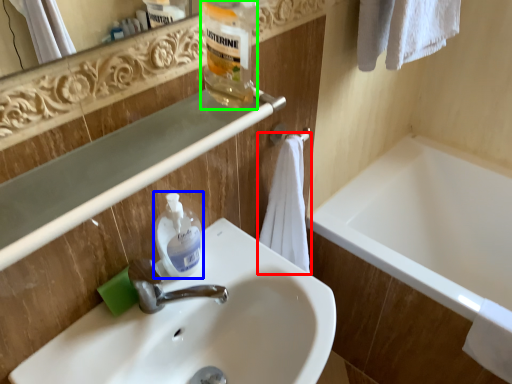
Question: Considering the real-world distances, which object is farthest from bath towel (highlighted by a red box)? cleaning product (highlighted by a blue box) or bottle (highlighted by a green box)?

Choices:
 (A) cleaning product
 (B) bottle

Answer: (B)